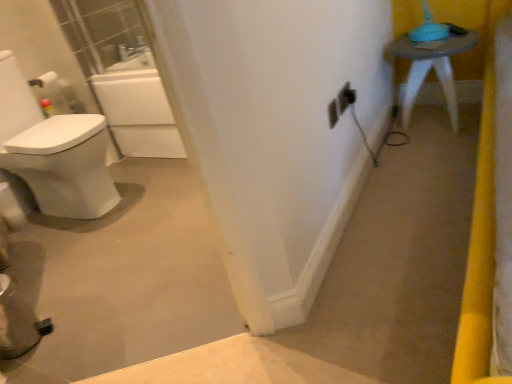
Question: From a real-world perspective, is matte gray stool at upper right located beneath black plastic outlet at center, the 2th electric outlet when ordered from right to left?

Choices:
 (A) yes
 (B) no

Answer: (A)

Question: Does matte gray stool at upper right touch black plastic outlet at center, the 2th electric outlet when ordered from right to left?

Choices:
 (A) yes
 (B) no

Answer: (B)

Question: Is there a large distance between matte gray stool at upper right and black plastic outlet at center, the 2th electric outlet when ordered from right to left?

Choices:
 (A) yes
 (B) no

Answer: (B)

Question: From the image's perspective, is matte gray stool at upper right above black plastic outlet at center, the 2th electric outlet when ordered from right to left?

Choices:
 (A) yes
 (B) no

Answer: (A)

Question: From the image's perspective, does matte gray stool at upper right appear lower than black plastic outlet at center, the 2th electric outlet viewed from the left?

Choices:
 (A) no
 (B) yes

Answer: (A)

Question: Considering the relative positions of matte gray stool at upper right and black plastic outlet at center, the 2th electric outlet when ordered from right to left, in the image provided, is matte gray stool at upper right to the left of black plastic outlet at center, the 2th electric outlet when ordered from right to left, from the viewer's perspective?

Choices:
 (A) yes
 (B) no

Answer: (B)

Question: Considering the relative sizes of white plastic electric outlet at center, which is counted as the third electric outlet, starting from the right, and matte gray stool at upper right in the image provided, is white plastic electric outlet at center, which is counted as the third electric outlet, starting from the right, shorter than matte gray stool at upper right?

Choices:
 (A) yes
 (B) no

Answer: (A)

Question: Can you confirm if white plastic electric outlet at center, which is counted as the third electric outlet, starting from the right, is wider than matte gray stool at upper right?

Choices:
 (A) no
 (B) yes

Answer: (A)

Question: Considering the relative positions of white plastic electric outlet at center, which is counted as the third electric outlet, starting from the right, and matte gray stool at upper right in the image provided, is white plastic electric outlet at center, which is counted as the third electric outlet, starting from the right, behind matte gray stool at upper right?

Choices:
 (A) no
 (B) yes

Answer: (A)

Question: From a real-world perspective, is white plastic electric outlet at center, which is counted as the third electric outlet, starting from the right, located beneath matte gray stool at upper right?

Choices:
 (A) yes
 (B) no

Answer: (B)

Question: From the image's perspective, would you say white plastic electric outlet at center, marked as the first electric outlet in a left-to-right arrangement, is positioned over matte gray stool at upper right?

Choices:
 (A) yes
 (B) no

Answer: (B)

Question: From a real-world perspective, is white plastic electric outlet at center, marked as the first electric outlet in a left-to-right arrangement, on matte gray stool at upper right?

Choices:
 (A) no
 (B) yes

Answer: (B)

Question: Does matte gray stool at upper right touch matte black outlet at center-right, placed as the 1th electric outlet when sorted from right to left?

Choices:
 (A) no
 (B) yes

Answer: (A)